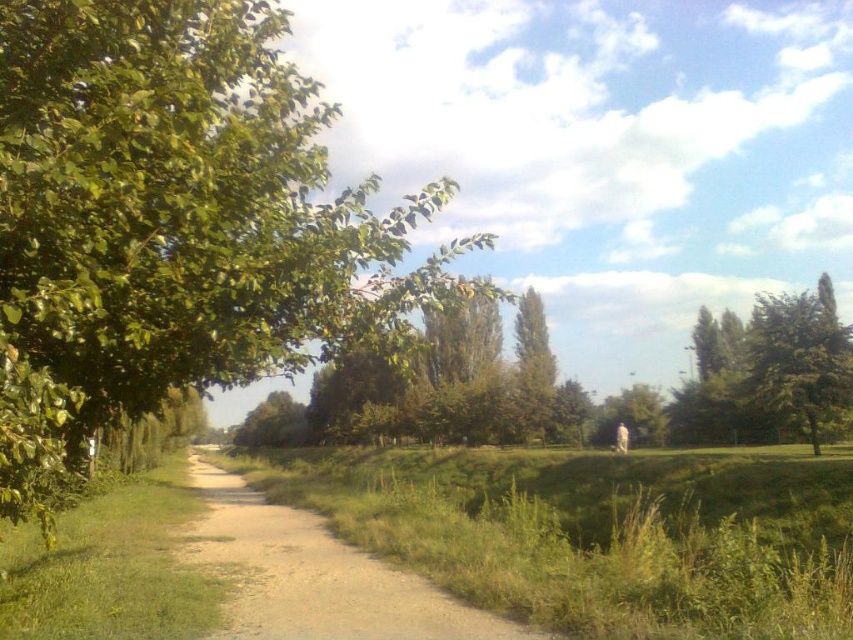
Can you confirm if green grass at lower center is positioned to the left of green leafy tree at right?

Yes, green grass at lower center is to the left of green leafy tree at right.

Is point (404, 541) closer to viewer compared to point (809, 401)?

Yes, it is in front of point (809, 401).

The width and height of the screenshot is (853, 640). Describe the element at coordinates (596, 532) in the screenshot. I see `green grass at lower center` at that location.

Image resolution: width=853 pixels, height=640 pixels. Identify the location of green grass at lower center. tap(596, 532).

Can you confirm if green leafy tree at left is wider than green leafy tree at right?

No.

Is point (209, 269) positioned before point (769, 406)?

Yes, it is.

At what (x,y) coordinates should I click in order to perform the action: click on green leafy tree at left. Please return your answer as a coordinate pair (x, y). Looking at the image, I should click on (173, 221).

Between point (747, 612) and point (285, 588), which one is positioned in front?

Point (747, 612) is in front.

Can you confirm if green grass at lower center is shorter than dirt/gravel path at center?

In fact, green grass at lower center may be taller than dirt/gravel path at center.

Which is in front, point (648, 467) or point (212, 451)?

Point (648, 467) is more forward.

The height and width of the screenshot is (640, 853). What are the coordinates of `green grass at lower center` in the screenshot? It's located at (596, 532).